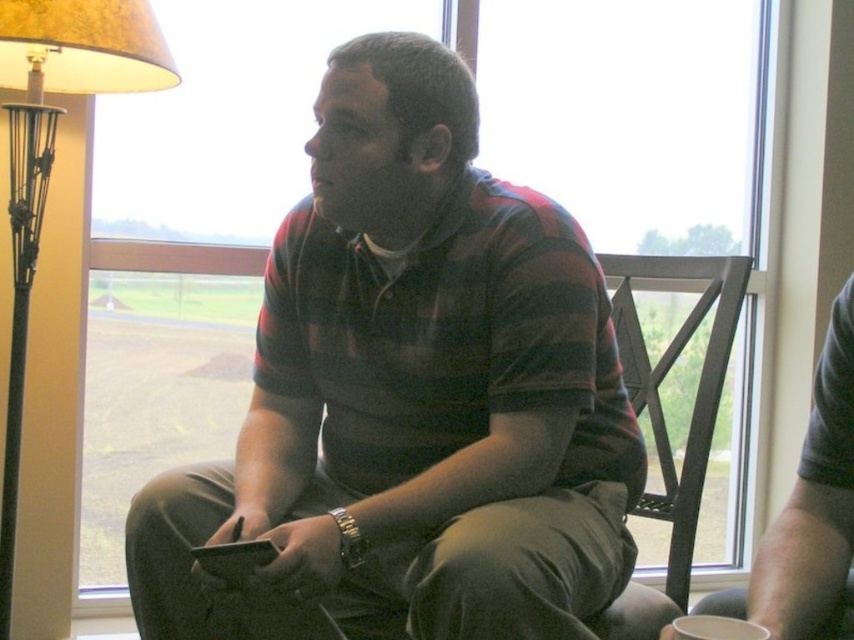
You are a delivery robot with a package that measures 1.2 meters in length. You need to navigate through the space between the metallic gold lamp at left and the dark brown leather armchair at center to deliver the package. Will the package fit through this space?

The distance between the metallic gold lamp at left and the dark brown leather armchair at center is 1.27 meters. Since the package is 1.2 meters long, it will fit through the space as there is enough clearance.